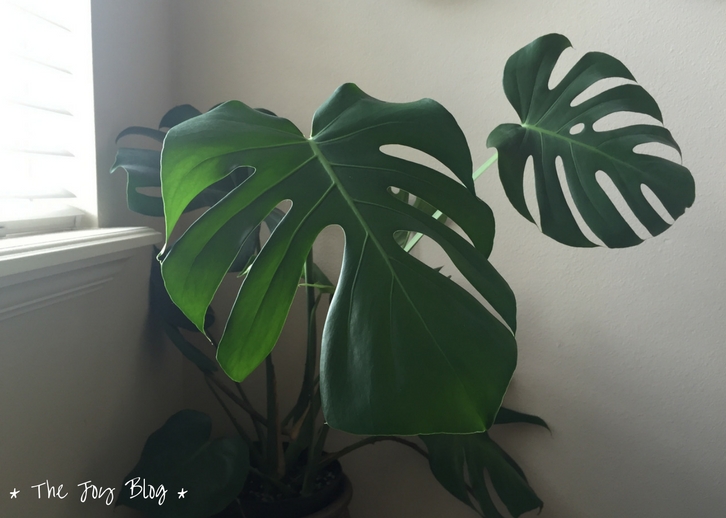
Locate an element on the screen. Image resolution: width=726 pixels, height=518 pixels. blinds is located at coordinates (60, 225), (60, 195), (59, 156), (60, 111), (65, 70), (62, 28).